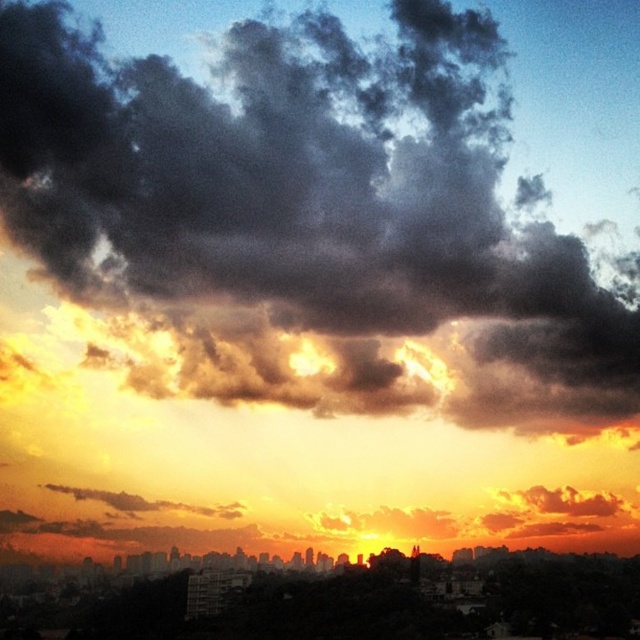
You are a drone operator tasked with capturing aerial footage of the dark gray fluffy cloud at upper center and the silhouetted cityscape at center. Your drone has a maximum flight range of 700 feet. Can you fly your drone from the city to the cloud and capture both without exceeding its range?

The dark gray fluffy cloud at upper center is 744.69 feet away from the silhouetted cityscape at center. Since the distance exceeds the drone maximum flight range of 700 feet, the drone cannot reach the cloud from the city without exceeding its range.

You are an airplane pilot preparing to land at an airport. You notice the dark gray fluffy cloud at upper center and the silhouetted cityscape at center in the distance. According to the scene, which object is positioned more to the left?

The dark gray fluffy cloud at upper center is positioned more to the left than the silhouetted cityscape at center.

You are standing at the camera position and want to reach the point marked at coordinates (72,68) in the image. Given that the point is 691.71 meters away, can you estimate whether you can walk directly to it without any obstacles?

The point at coordinates (72,68) is 691.71 meters away from the camera. However, the scene description mentions a city skyline with buildings, so there might be obstacles like buildings or structures blocking the direct path. Without specific information about the terrain or obstacles between the camera and the point, it is not possible to confirm if you can walk directly to it.